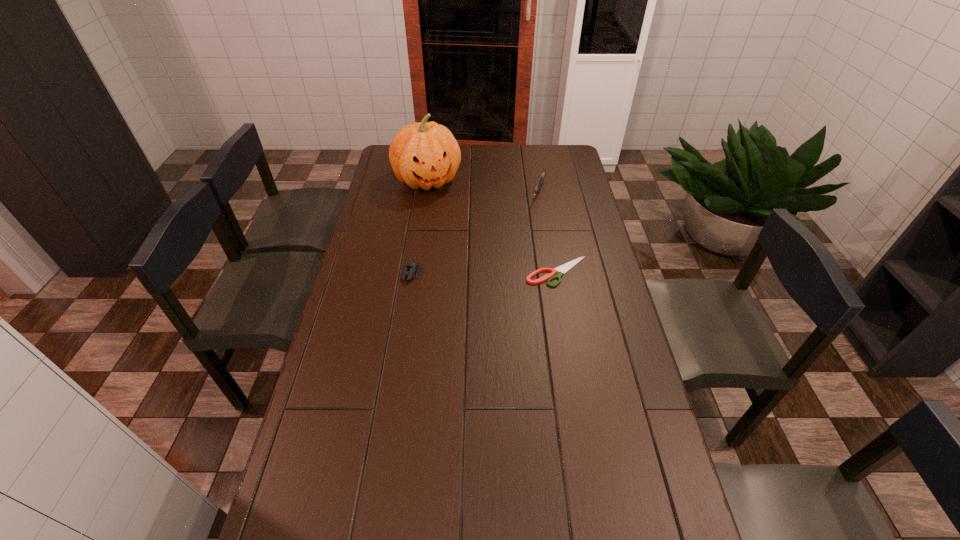
The width and height of the screenshot is (960, 540). I want to click on free space located aimed along the barrel of the second tallest object, so click(534, 217).

Locate an element on the screen. Image resolution: width=960 pixels, height=540 pixels. free location located aimed along the barrel of the second tallest object is located at coordinates (535, 214).

Identify the location of object that is at the far edge. The image size is (960, 540). (423, 155).

The height and width of the screenshot is (540, 960). I want to click on object positioned at the left edge, so click(423, 155).

What are the coordinates of `object located in the right edge section of the desktop` in the screenshot? It's located at (562, 269).

Locate an element on the screen. This screenshot has width=960, height=540. object located at the far left corner is located at coordinates (423, 155).

The width and height of the screenshot is (960, 540). In order to click on free location at the far edge in this screenshot , I will do `click(524, 146)`.

In the image, there is a desktop. At what (x,y) coordinates should I click in order to perform the action: click on vacant space at the near edge. Please return your answer as a coordinate pair (x, y). This screenshot has width=960, height=540. Looking at the image, I should click on (399, 510).

Find the location of a particular element. This screenshot has height=540, width=960. vacant space at the left edge of the desktop is located at coordinates (350, 342).

The width and height of the screenshot is (960, 540). I want to click on free spot at the right edge of the desktop, so click(560, 193).